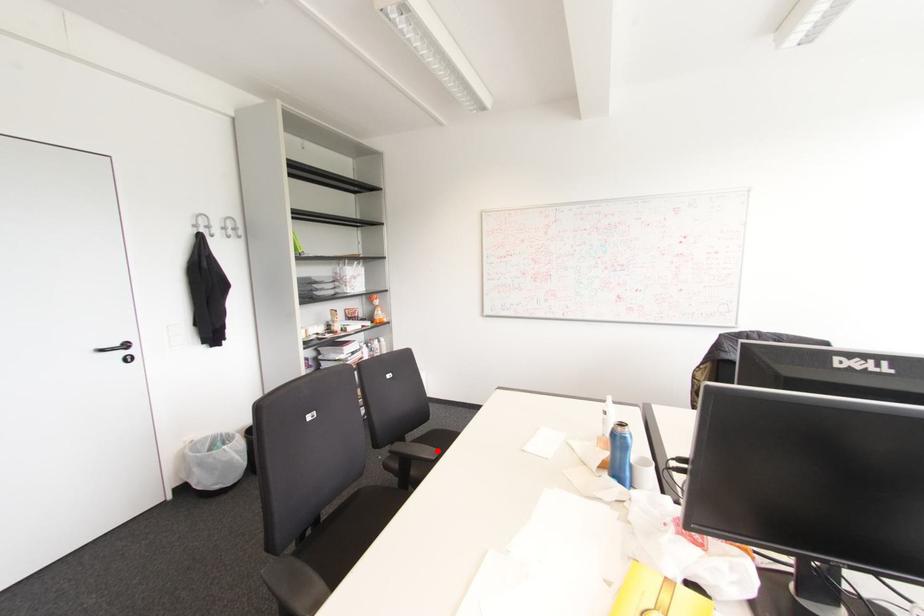
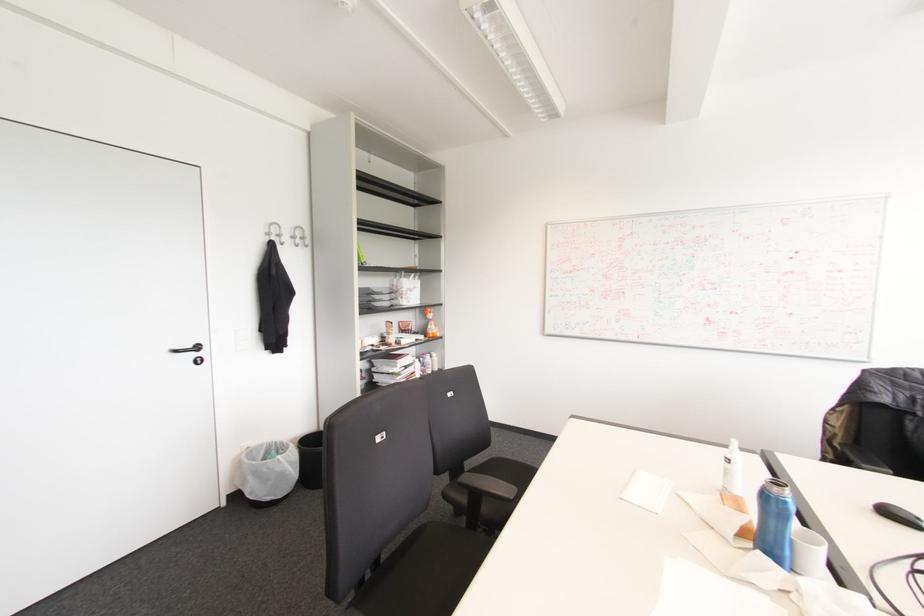
Find the pixel in the second image that matches the highlighted location in the first image.

(515, 488)